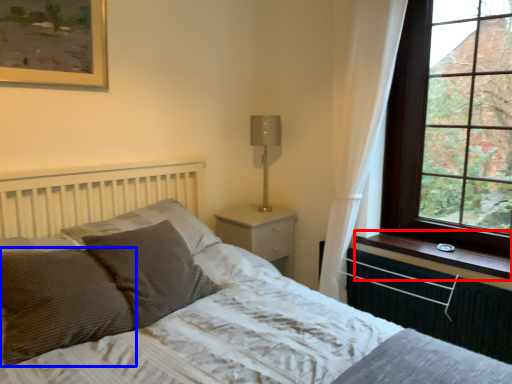
Question: Which of the following is the closest to the observer, window sill (highlighted by a red box) or pillow (highlighted by a blue box)?

Choices:
 (A) window sill
 (B) pillow

Answer: (B)